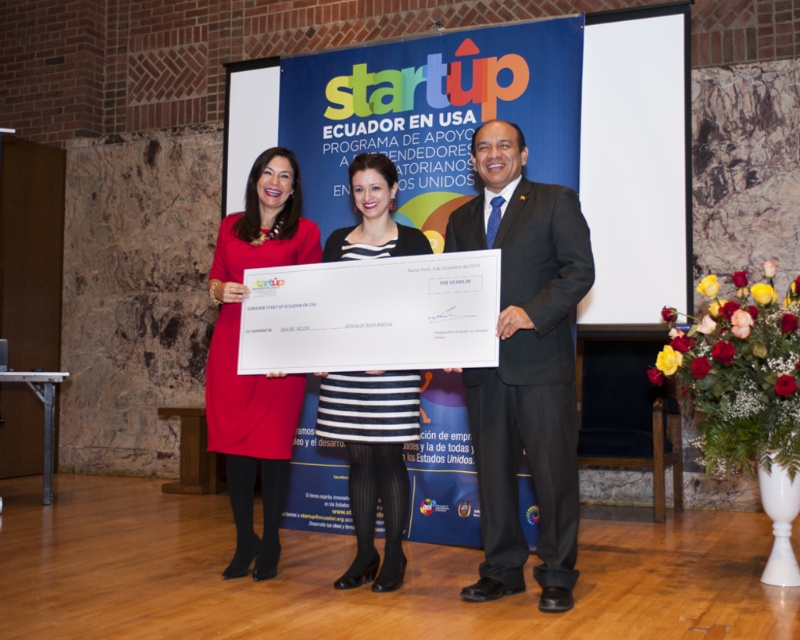
You are attending the event and want to take a photo with both the matte red dress at center and the striped fabric dress at center. Which dress should you stand closer to if you want both to appear the same size in the photo?

You should stand closer to the striped fabric dress at center because the matte red dress at center is taller than the striped fabric dress at center. To make them appear the same size in the photo, you need to position yourself closer to the shorter striped fabric dress at center.